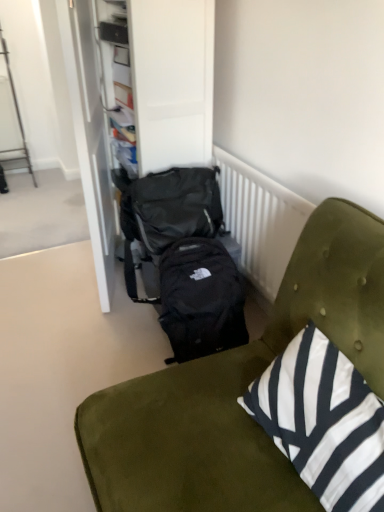
Question: Considering the relative sizes of black fabric dresser at center and white striped fabric pillow at lower right in the image provided, is black fabric dresser at center wider than white striped fabric pillow at lower right?

Choices:
 (A) no
 (B) yes

Answer: (B)

Question: Can you confirm if black fabric dresser at center is thinner than white striped fabric pillow at lower right?

Choices:
 (A) no
 (B) yes

Answer: (A)

Question: From the image's perspective, is black fabric dresser at center on white striped fabric pillow at lower right?

Choices:
 (A) yes
 (B) no

Answer: (A)

Question: Can you confirm if black fabric dresser at center is positioned to the left of white striped fabric pillow at lower right?

Choices:
 (A) no
 (B) yes

Answer: (B)

Question: Is black fabric dresser at center to the right of white striped fabric pillow at lower right from the viewer's perspective?

Choices:
 (A) no
 (B) yes

Answer: (A)

Question: From a real-world perspective, is white striped fabric pillow at lower right above or below black fabric backpack at center, positioned as the first backpack in top-to-bottom order?

Choices:
 (A) above
 (B) below

Answer: (A)

Question: In the image, is white striped fabric pillow at lower right on the left side or the right side of black fabric backpack at center, the second backpack ordered from the bottom?

Choices:
 (A) right
 (B) left

Answer: (A)

Question: Considering the positions of white striped fabric pillow at lower right and black fabric backpack at center, the second backpack ordered from the bottom, in the image, is white striped fabric pillow at lower right wider or thinner than black fabric backpack at center, the second backpack ordered from the bottom,?

Choices:
 (A) wide
 (B) thin

Answer: (A)

Question: In terms of height, does white striped fabric pillow at lower right look taller or shorter compared to black fabric backpack at center, positioned as the first backpack in top-to-bottom order?

Choices:
 (A) short
 (B) tall

Answer: (B)

Question: Would you say white striped fabric pillow at lower right is to the left or to the right of black fabric backpack at center in the picture?

Choices:
 (A) left
 (B) right

Answer: (B)

Question: Would you say white striped fabric pillow at lower right is inside or outside black fabric backpack at center?

Choices:
 (A) inside
 (B) outside

Answer: (A)

Question: From the image's perspective, is white striped fabric pillow at lower right above or below black fabric backpack at center?

Choices:
 (A) above
 (B) below

Answer: (A)

Question: Is white striped fabric pillow at lower right in front of or behind black fabric backpack at center in the image?

Choices:
 (A) behind
 (B) front

Answer: (A)

Question: From the image's perspective, is black fabric backpack at center located above or below black fabric backpack at center, positioned as the first backpack in top-to-bottom order?

Choices:
 (A) above
 (B) below

Answer: (B)

Question: Based on their sizes in the image, would you say black fabric backpack at center is bigger or smaller than black fabric backpack at center, the second backpack ordered from the bottom?

Choices:
 (A) small
 (B) big

Answer: (B)